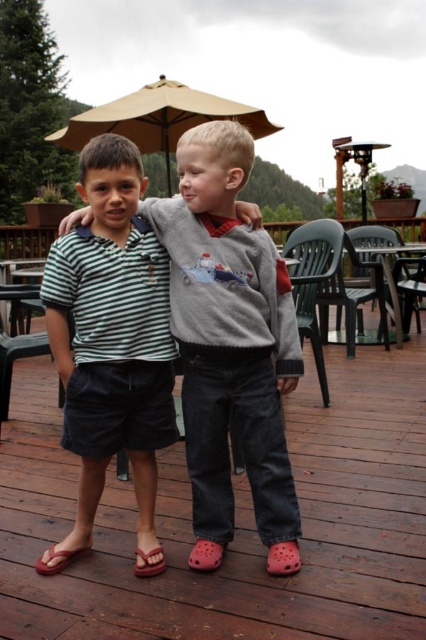
Identify the location of beige fabric umbrella at upper center. (158, 118).

In the scene shown: Does beige fabric umbrella at upper center have a smaller size compared to croc shoe at lower right?

No.

Who is more distant from viewer, (x=126, y=118) or (x=279, y=568)?

Positioned behind is point (x=126, y=118).

This screenshot has width=426, height=640. In order to click on beige fabric umbrella at upper center in this screenshot , I will do `click(158, 118)`.

Which of these two, wooden deck at center or brown suede sandal at lower center, stands shorter?

brown suede sandal at lower center

Does point (382, 451) come farther from viewer compared to point (152, 576)?

Yes.

This screenshot has height=640, width=426. In order to click on wooden deck at center in this screenshot , I will do `click(236, 522)`.

Is striped cotton shirt at center to the left of black plastic chair at lower left from the viewer's perspective?

In fact, striped cotton shirt at center is to the right of black plastic chair at lower left.

Between striped cotton shirt at center and black plastic chair at lower left, which one appears on the right side from the viewer's perspective?

From the viewer's perspective, striped cotton shirt at center appears more on the right side.

Is point (193, 198) positioned before point (43, 336)?

Yes, point (193, 198) is in front of point (43, 336).

Locate an element on the screen. The image size is (426, 640). striped cotton shirt at center is located at coordinates (229, 333).